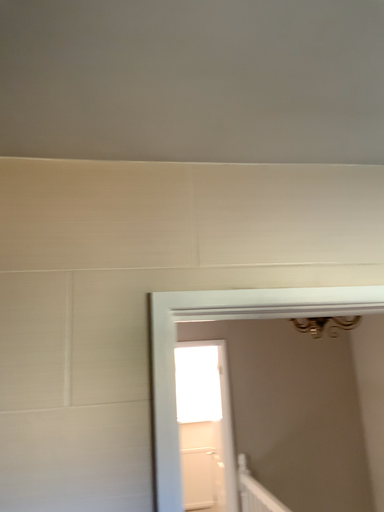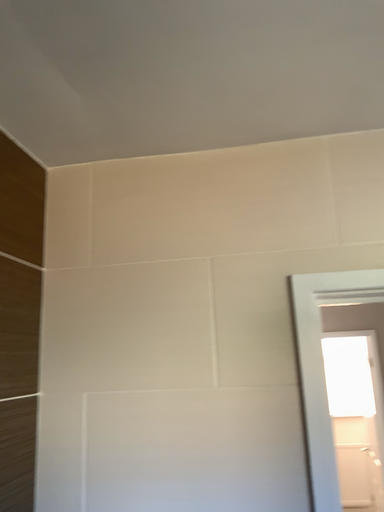
Question: How did the camera likely rotate when shooting the video?

Choices:
 (A) rotated right
 (B) rotated left

Answer: (B)